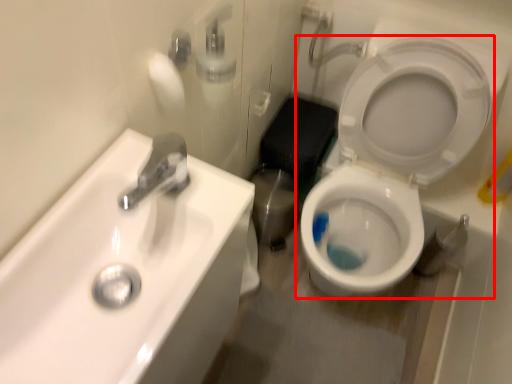
Question: In this image, where is toilet (annotated by the red box) located relative to sink?

Choices:
 (A) right
 (B) left

Answer: (A)